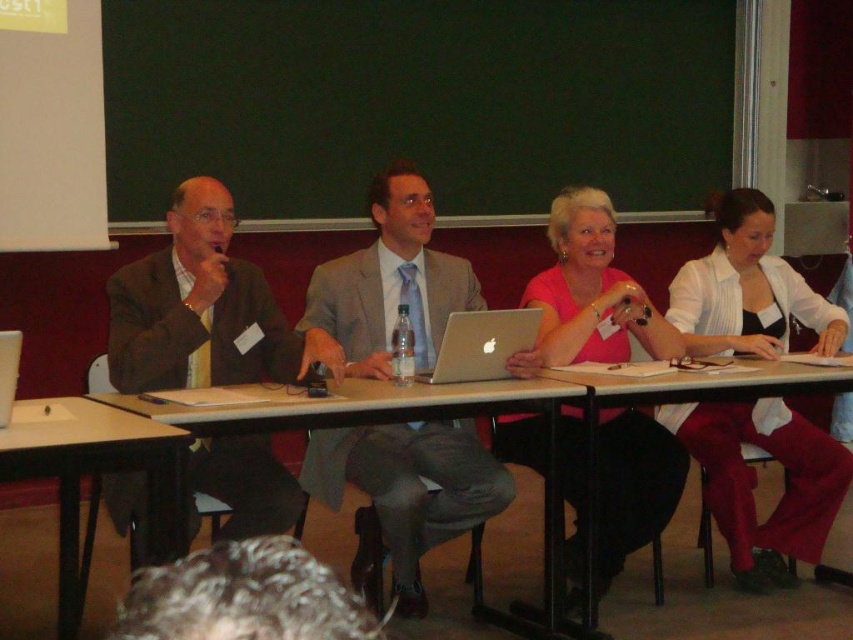
Question: Does white plastic table at center appear over wooden table at lower left?

Choices:
 (A) no
 (B) yes

Answer: (A)

Question: Among these objects, which one is farthest from the camera?

Choices:
 (A) light gray suit at center
 (B) wooden table at lower left

Answer: (A)

Question: Among these points, which one is nearest to the camera?

Choices:
 (A) (555, 602)
 (B) (496, 352)
 (C) (727, 538)

Answer: (B)

Question: Where is pink matte shirt at center located in relation to silver metallic laptop at center in the image?

Choices:
 (A) below
 (B) above

Answer: (A)

Question: From the image, what is the correct spatial relationship of light gray suit at center in relation to wooden table at lower left?

Choices:
 (A) below
 (B) above

Answer: (B)

Question: Considering the real-world distances, which object is farthest from the wooden table at lower left?

Choices:
 (A) matte brown suit at left
 (B) pink matte shirt at center

Answer: (B)